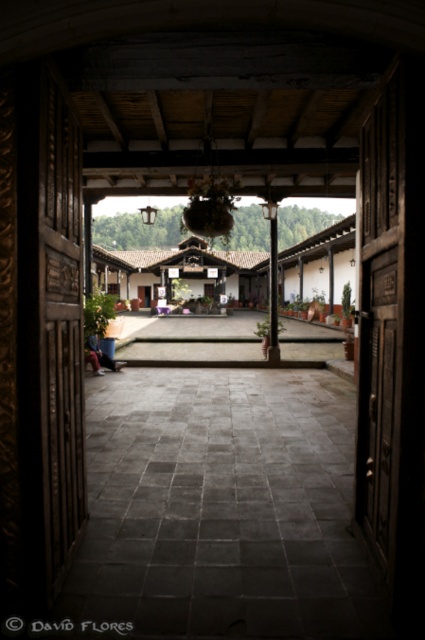
Question: Does dark brown wooden door at left have a smaller size compared to smooth stone pillar at center?

Choices:
 (A) yes
 (B) no

Answer: (B)

Question: Which point is farther from the camera taking this photo?

Choices:
 (A) (271, 230)
 (B) (53, 524)

Answer: (A)

Question: Does dark brown wooden door at left lie behind smooth stone pillar at center?

Choices:
 (A) yes
 (B) no

Answer: (B)

Question: Does dark brown wooden door at left have a larger size compared to smooth stone pillar at center?

Choices:
 (A) no
 (B) yes

Answer: (B)

Question: Which point is closer to the camera taking this photo?

Choices:
 (A) (272, 250)
 (B) (62, 248)

Answer: (B)